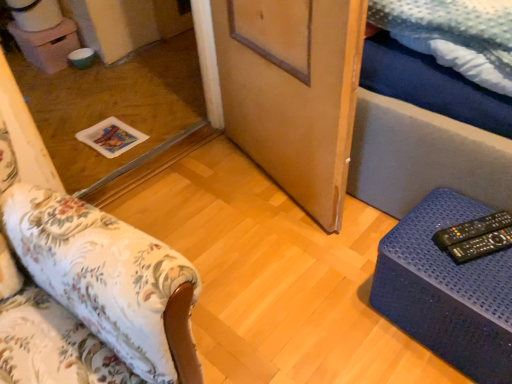
Find the location of `free point behind black plastic remote at lower right, which is the 1th remote in front-to-back order`. free point behind black plastic remote at lower right, which is the 1th remote in front-to-back order is located at coordinates (454, 209).